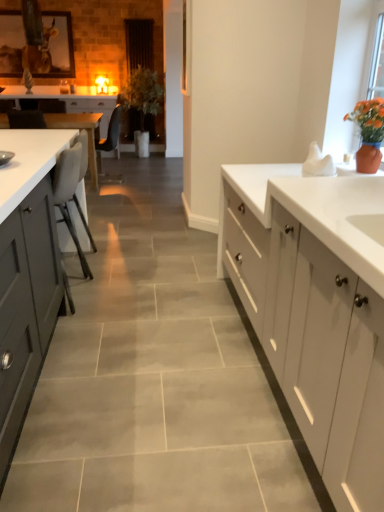
Question: Does white glossy table at left appear on the right side of matte gray cabinets at left, which appears as the 1th cabinetry when viewed from the front?

Choices:
 (A) yes
 (B) no

Answer: (B)

Question: Is white glossy table at left to the left of matte gray cabinets at left, arranged as the 2th cabinetry when viewed from the top, from the viewer's perspective?

Choices:
 (A) yes
 (B) no

Answer: (A)

Question: Is white glossy table at left outside of matte gray cabinets at left, arranged as the 2th cabinetry when viewed from the top?

Choices:
 (A) yes
 (B) no

Answer: (A)

Question: Is white glossy table at left positioned far away from matte gray cabinets at left, which appears as the 1th cabinetry when viewed from the front?

Choices:
 (A) yes
 (B) no

Answer: (A)

Question: Is white glossy table at left thinner than matte gray cabinets at left, the 2th cabinetry from the back?

Choices:
 (A) yes
 (B) no

Answer: (A)

Question: Considering the positions of matte gray cabinets at left, which appears as the 1th cabinetry when viewed from the front, and white glossy table at left in the image, is matte gray cabinets at left, which appears as the 1th cabinetry when viewed from the front, bigger or smaller than white glossy table at left?

Choices:
 (A) small
 (B) big

Answer: (B)

Question: Relative to white glossy table at left, is matte gray cabinets at left, arranged as the 2th cabinetry when viewed from the top, in front or behind?

Choices:
 (A) front
 (B) behind

Answer: (A)

Question: From a real-world perspective, is matte gray cabinets at left, acting as the first cabinetry starting from the bottom, positioned above or below white glossy table at left?

Choices:
 (A) below
 (B) above

Answer: (B)

Question: Is matte gray cabinets at left, which appears as the 1th cabinetry when viewed from the front, inside the boundaries of white glossy table at left, or outside?

Choices:
 (A) inside
 (B) outside

Answer: (B)

Question: Is white glossy countertop at right taller or shorter than green matte plant at center?

Choices:
 (A) short
 (B) tall

Answer: (A)

Question: Is white glossy countertop at right wider or thinner than green matte plant at center?

Choices:
 (A) wide
 (B) thin

Answer: (B)

Question: Is white glossy countertop at right inside the boundaries of green matte plant at center, or outside?

Choices:
 (A) outside
 (B) inside

Answer: (A)

Question: Considering the relative positions of white glossy countertop at right and green matte plant at center in the image provided, is white glossy countertop at right to the left or to the right of green matte plant at center?

Choices:
 (A) left
 (B) right

Answer: (B)

Question: Considering the positions of white matte cabinet at center, marked as the 2th cabinetry in a bottom-to-top arrangement, and green matte plant at center in the image, is white matte cabinet at center, marked as the 2th cabinetry in a bottom-to-top arrangement, bigger or smaller than green matte plant at center?

Choices:
 (A) big
 (B) small

Answer: (B)

Question: In the image, is white matte cabinet at center, the 1th cabinetry from the top, positioned in front of or behind green matte plant at center?

Choices:
 (A) front
 (B) behind

Answer: (B)